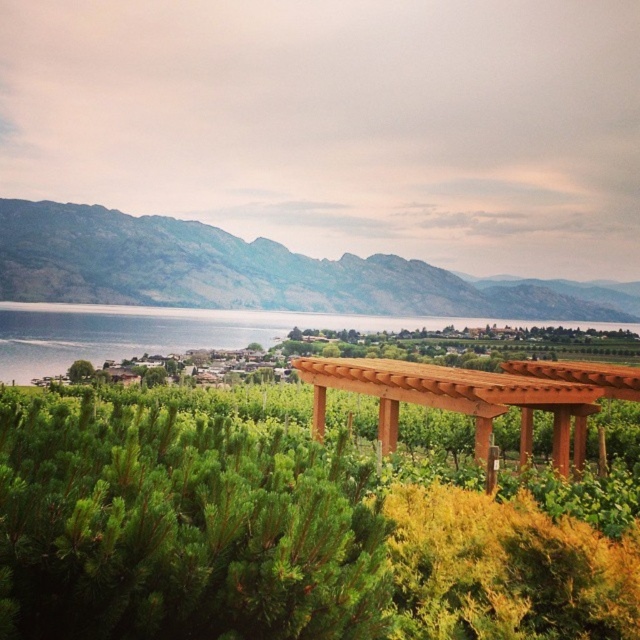
In the scene shown: Is brown wooden pergola at center above green leafy tree at lower left?

Correct, brown wooden pergola at center is located above green leafy tree at lower left.

Does point (314, 378) lie in front of point (80, 371)?

Yes, point (314, 378) is in front of point (80, 371).

Does point (580, 369) come behind point (72, 372)?

That is False.

Find the location of a particular element. The height and width of the screenshot is (640, 640). brown wooden pergola at center is located at coordinates (477, 396).

Is the position of gray rock mountain at upper left more distant than that of brown wooden pergola at center?

Yes.

Which is behind, point (83, 288) or point (608, 372)?

The point (83, 288) is behind.

The width and height of the screenshot is (640, 640). What are the coordinates of `gray rock mountain at upper left` in the screenshot? It's located at (236, 269).

Is point (413, 307) positioned after point (74, 378)?

Yes, point (413, 307) is farther from viewer.

Is point (163, 225) closer to camera compared to point (88, 365)?

No.

Where is `gray rock mountain at upper left`? gray rock mountain at upper left is located at coordinates (236, 269).

In order to click on gray rock mountain at upper left in this screenshot , I will do `click(236, 269)`.